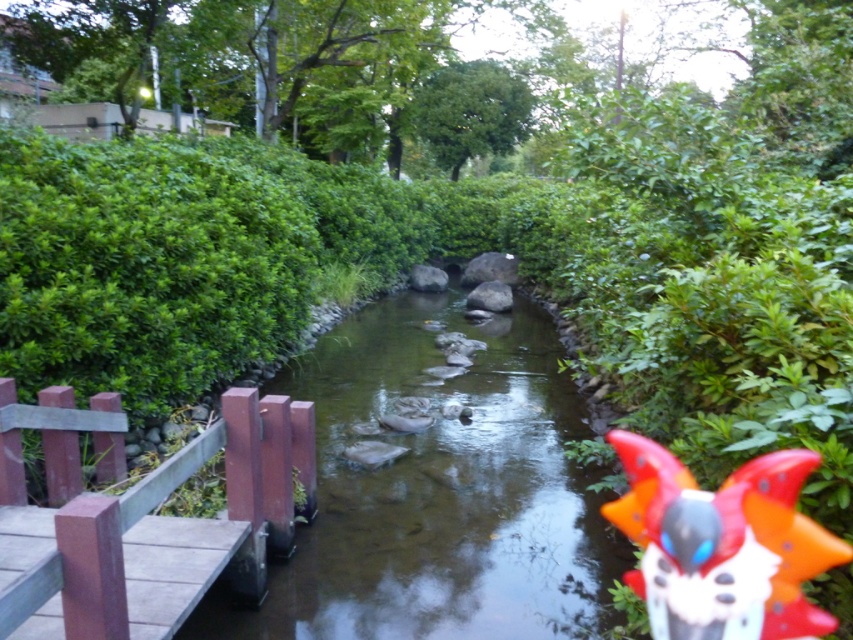
You are a hiker who wants to place a 20 meter long tent between the shiny plastic toy at right and the green leafy bush at upper center. Based on the scene, will the tent fit between them?

The distance between the shiny plastic toy at right and the green leafy bush at upper center is 18.29 meters, so the 20 meter long tent will not fit between them as it is longer than the available space.